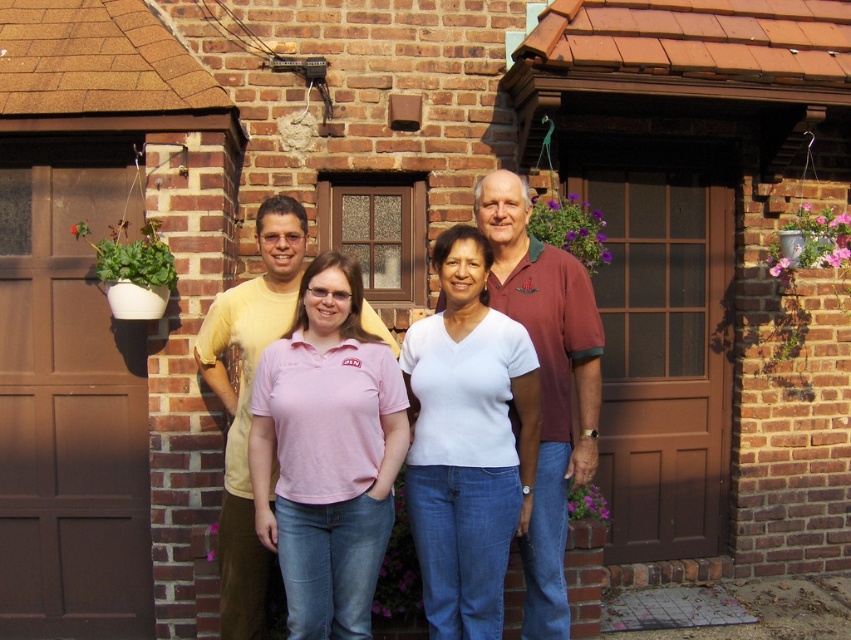
You are a photographer trying to adjust the camera focus. You notice two people in the front row wearing a white matte shirt at center and a pink cotton shirt at center. Which one should you focus on first if you want to ensure the taller person is in focus?

The pink cotton shirt at center is taller than the white matte shirt at center, so you should focus on the person wearing the pink cotton shirt at center first to ensure the taller individual is in focus.

You are a photographer taking a picture of two people wearing a pink cotton polo shirt at center and a white matte shirt at center. Which shirt is closer to the camera?

The pink cotton polo shirt at center is closer to the camera because it is in front of the white matte shirt at center.